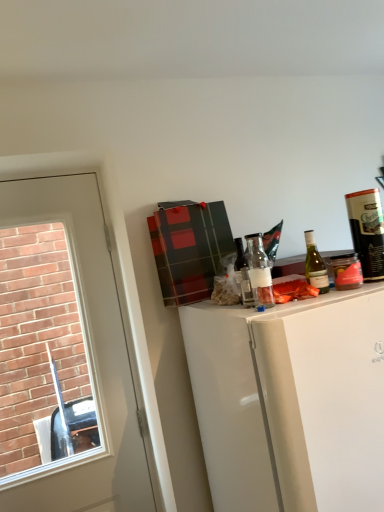
Image resolution: width=384 pixels, height=512 pixels. Identify the location of free space in front of green glass bottle at upper right, the second bottle when ordered from left to right. (334, 301).